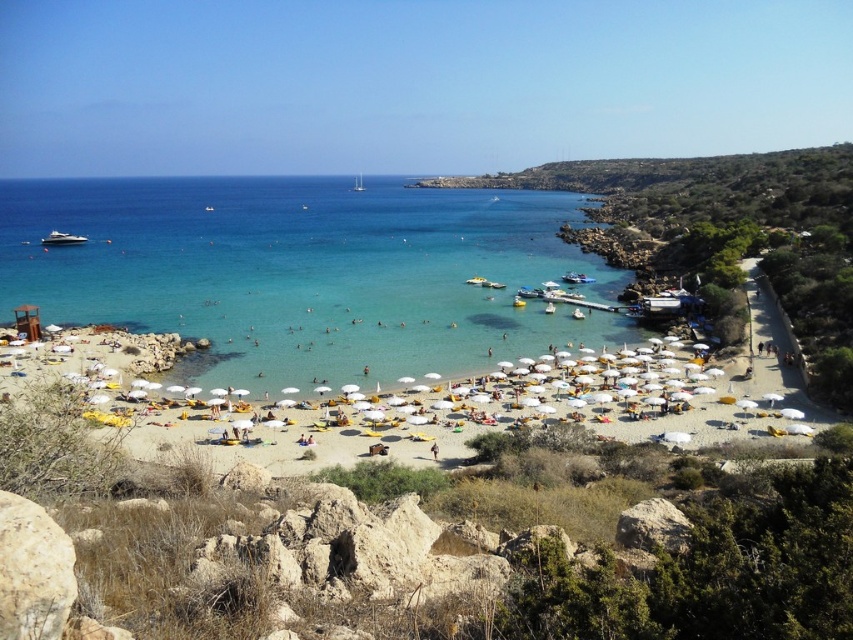
You are a photographer trying to capture a photo of both the white glossy boat at left and the white plastic boat at center. Since you want them both in the frame, which boat should you position closer to the center of your camera viewfinder to include both?

You should position the white plastic boat at center closer to the center of your camera viewfinder because the white glossy boat at left is on the left side of it, so centering the white plastic boat at center will naturally include the white glossy boat at left in the frame.